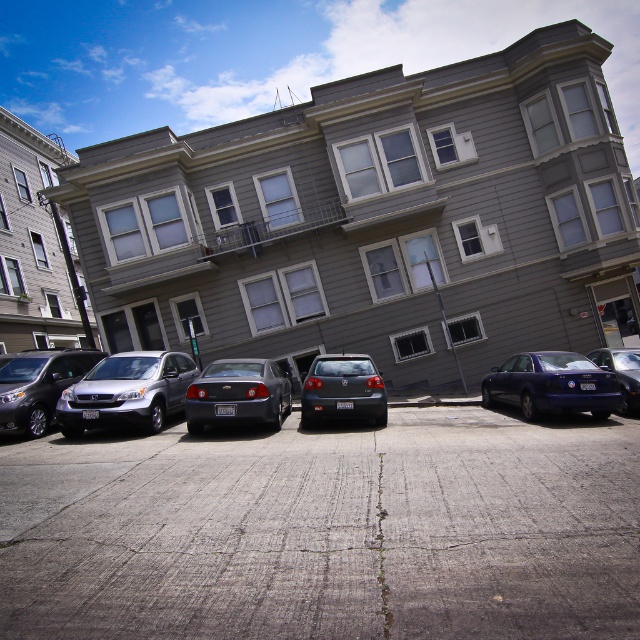
You are standing at point (38, 385) in the parking lot. What vehicle is located at your current position?

The silver metallic minivan at left is located at point (38, 385).

You are a delivery person trying to park your 1.8 meters tall delivery box in the parking lot. You see the shiny dark blue sedan at center right and the silver metallic minivan at left. Which vehicle can you place the box between without it being taller than either?

The shiny dark blue sedan at center right has a lesser height compared to the silver metallic minivan at left, so you can place the delivery box between the shiny dark blue sedan at center right and the silver metallic minivan at left. Since the box is 1.8 meters tall, it will be shorter than the minivan and taller than the sedan, but as long as it is placed between them, it won answer exceed the height of either vehicle. However, the box must be placed in a position where its height does not surpass either

You are a delivery driver who needs to park your vehicle in the parking lot near the residential building. You have a delivery van that is 5 meters long. The parking spots are standard size. Can you fit your van into the parking spot next to the shiny black sedan at right if the silver metallic minivan at left is already parked there?

The silver metallic minivan at left is larger than the shiny black sedan at right. Since the parking spots are standard size, the silver metallic minivan at left must already occupy more space than the standard spot. Therefore, your delivery van, which is 5 meters long, may not fit into the remaining space next to the shiny black sedan at right.